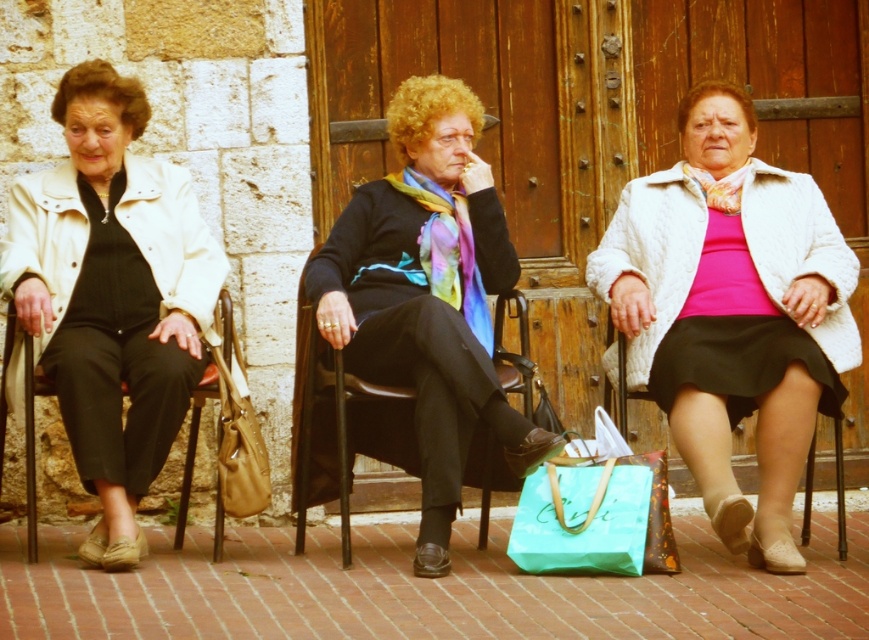
You are a delivery person trying to place a small package between the metallic brown chair at left and the leather handbag at lower left. Can the package fit in the space between them?

The metallic brown chair at left is wider than the leather handbag at lower left, so the space between them may be sufficient to fit a small package, depending on the exact dimensions. However, since the chair is wider, there might be enough space for the package to fit between them.

In the scene shown: You are a photographer setting up a shoot in this scene. You need to place a small prop on the metallic brown chair at left without covering the white textured coat at center. Is this possible?

The white textured coat at center is positioned over the metallic brown chair at left, so placing the prop on the chair would require moving the coat first to avoid covering it.

You are organizing a small picnic and need to carry a metallic silver chair at center. Can the teal fabric shopping bag at center hold the chair?

The teal fabric shopping bag at center is larger in size than metallic silver chair at center, so it can hold the chair.